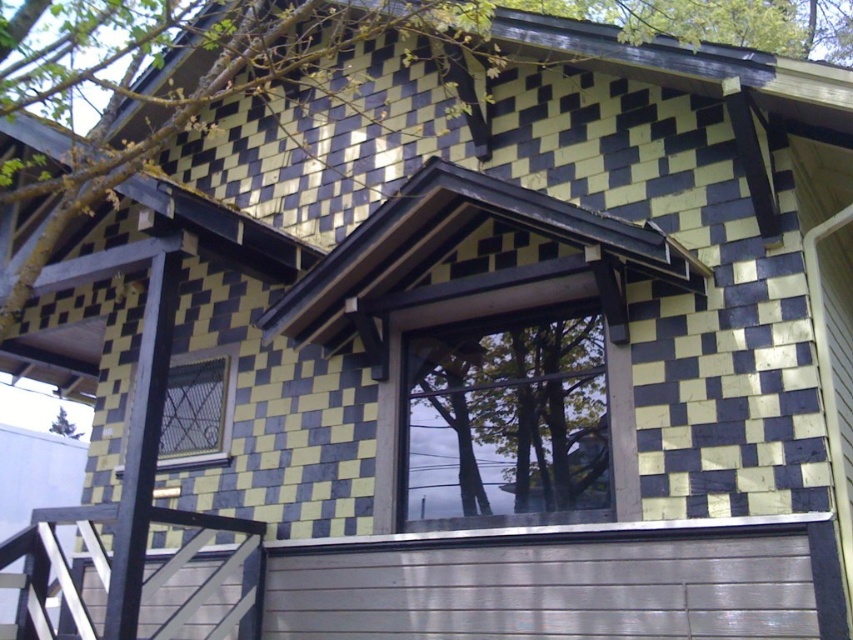
Who is lower down, wooden balustrade at lower left or smooth gray stair at lower left?

smooth gray stair at lower left

Which is behind, point (196, 589) or point (196, 632)?

Positioned behind is point (196, 632).

You are a GUI agent. You are given a task and a screenshot of the screen. Output one action in this format:
    pyautogui.click(x=<x>, y=<y>)
    Task: Click on the wooden balustrade at lower left
    
    Given the screenshot: What is the action you would take?
    pyautogui.click(x=51, y=570)

Find the location of a particular element. The height and width of the screenshot is (640, 853). white painted wood garage door at lower center is located at coordinates (547, 588).

Is white painted wood garage door at lower center positioned at the back of wooden balustrade at lower left?

No, white painted wood garage door at lower center is closer to the viewer.

Locate an element on the screen. This screenshot has height=640, width=853. white painted wood garage door at lower center is located at coordinates (547, 588).

Between white painted wood garage door at lower center and smooth gray stair at lower left, which one has less height?

Standing shorter between the two is smooth gray stair at lower left.

Which is below, white painted wood garage door at lower center or smooth gray stair at lower left?

smooth gray stair at lower left

This screenshot has width=853, height=640. What do you see at coordinates (547, 588) in the screenshot? I see `white painted wood garage door at lower center` at bounding box center [547, 588].

Locate an element on the screen. white painted wood garage door at lower center is located at coordinates (547, 588).